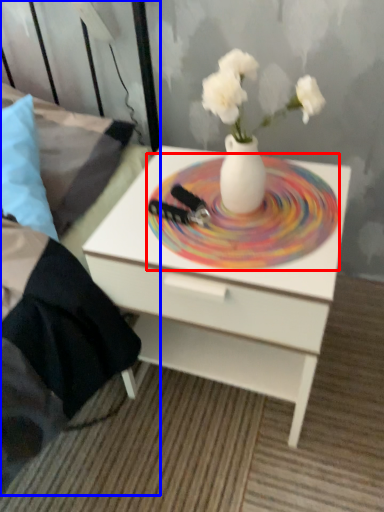
Question: Which of the following is the closest to the observer, plate (highlighted by a red box) or bed frame (highlighted by a blue box)?

Choices:
 (A) plate
 (B) bed frame

Answer: (B)